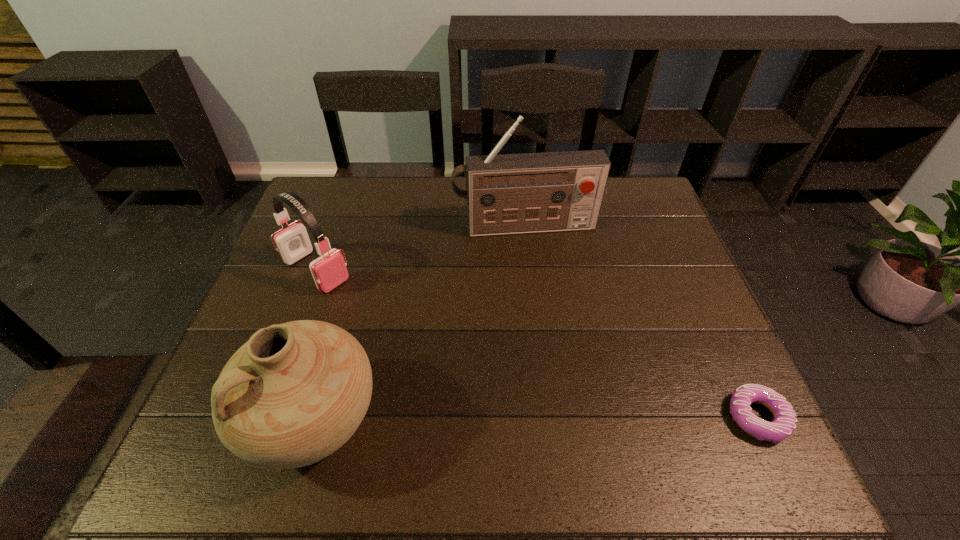
Identify the location of free space on the desktop that is between the pottery and the rightmost object and is positioned on the outer surface of the earphone. (510, 419).

The height and width of the screenshot is (540, 960). In order to click on vacant space on the desktop that is between the pottery and the rightmost object and is positioned on the front panel of the third object from left to right in this screenshot , I will do `click(573, 418)`.